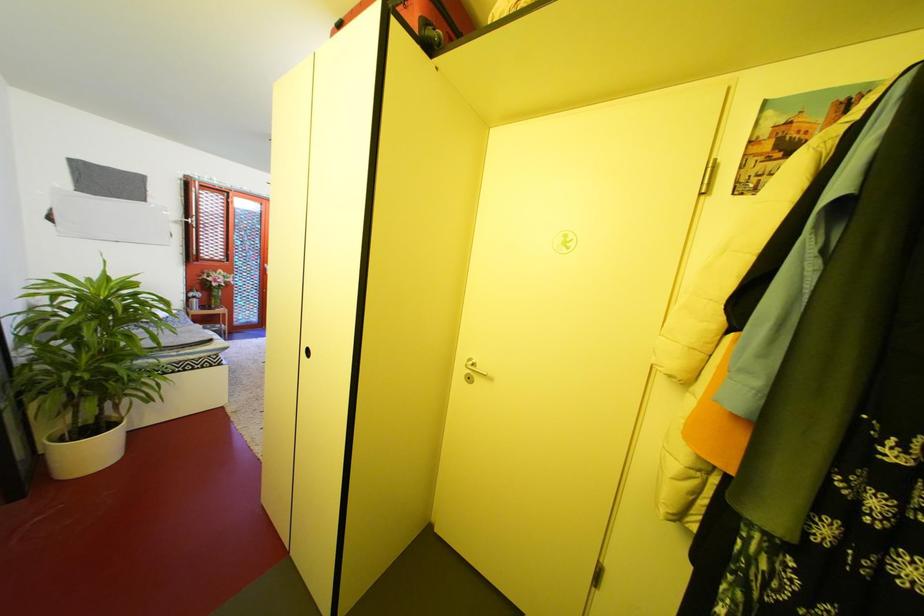
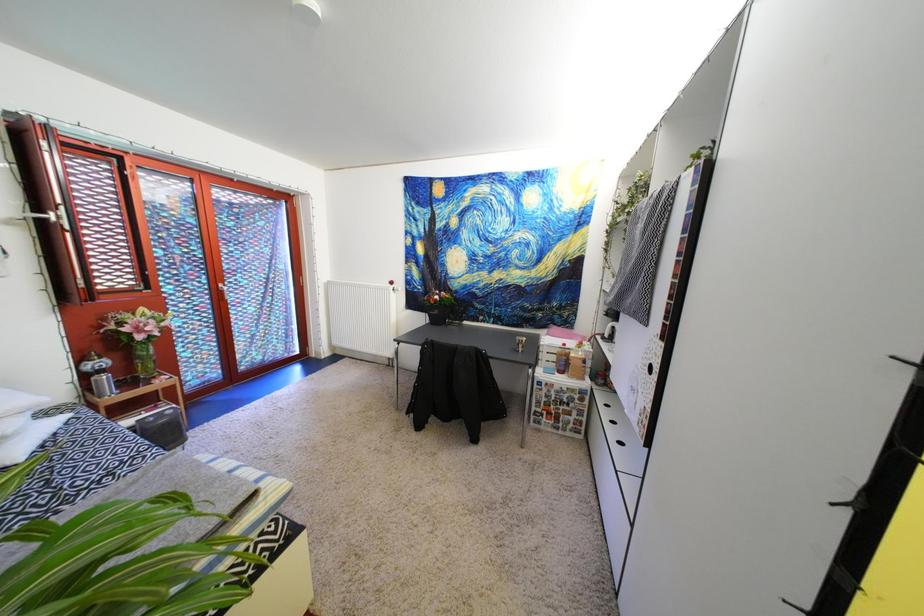
The images are taken continuously from a first-person perspective. In which direction are you moving?

The movement direction of the cameraman is left, forward.